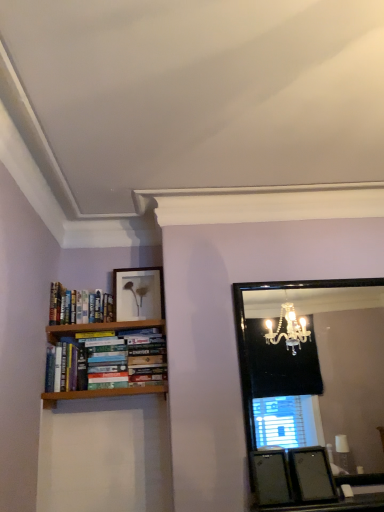
Question: Is black glass mirror at upper right taller than matte white picture frame at upper center, arranged as the 1th picture frame when viewed from the top?

Choices:
 (A) yes
 (B) no

Answer: (A)

Question: Can you confirm if black glass mirror at upper right is shorter than matte white picture frame at upper center, which appears as the first picture frame when viewed from the left?

Choices:
 (A) no
 (B) yes

Answer: (A)

Question: Is black glass mirror at upper right at the left side of matte white picture frame at upper center, positioned as the 2th picture frame in front-to-back order?

Choices:
 (A) no
 (B) yes

Answer: (A)

Question: Can you confirm if black glass mirror at upper right is positioned to the right of matte white picture frame at upper center, which appears as the first picture frame when viewed from the left?

Choices:
 (A) no
 (B) yes

Answer: (B)

Question: Would you say black glass mirror at upper right is outside matte white picture frame at upper center, which is the first picture frame in back-to-front order?

Choices:
 (A) yes
 (B) no

Answer: (A)

Question: From a real-world perspective, is black glass mirror at upper right physically below matte white picture frame at upper center, arranged as the 1th picture frame when viewed from the top?

Choices:
 (A) yes
 (B) no

Answer: (A)

Question: From the image's perspective, is matte black picture frame at lower right, which is counted as the 2th picture frame, starting from the top, below hardcover books at left?

Choices:
 (A) yes
 (B) no

Answer: (A)

Question: Would you consider matte black picture frame at lower right, the second picture frame positioned from the back, to be distant from hardcover books at left?

Choices:
 (A) no
 (B) yes

Answer: (B)

Question: Is matte black picture frame at lower right, which is counted as the 2th picture frame, starting from the top, wider than hardcover books at left?

Choices:
 (A) no
 (B) yes

Answer: (B)

Question: Considering the relative sizes of matte black picture frame at lower right, the 1th picture frame ordered from the bottom, and hardcover books at left in the image provided, is matte black picture frame at lower right, the 1th picture frame ordered from the bottom, taller than hardcover books at left?

Choices:
 (A) yes
 (B) no

Answer: (B)

Question: Can you confirm if matte black picture frame at lower right, the first picture frame in the front-to-back sequence, is shorter than hardcover books at left?

Choices:
 (A) no
 (B) yes

Answer: (B)

Question: Would you say matte black picture frame at lower right, placed as the 1th picture frame when sorted from right to left, contains hardcover books at left?

Choices:
 (A) no
 (B) yes

Answer: (A)

Question: Is hardcover books at left oriented away from matte white picture frame at upper center, arranged as the 1th picture frame when viewed from the top?

Choices:
 (A) no
 (B) yes

Answer: (A)